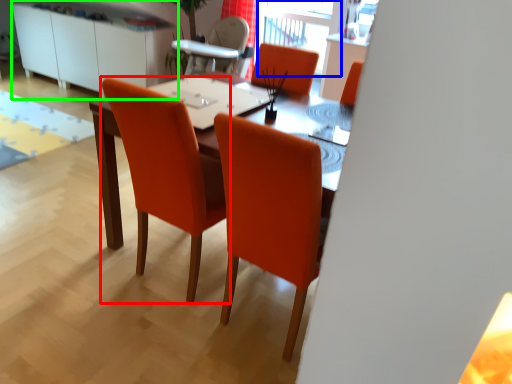
Question: Which is farther away from chair (highlighted by a red box)? window screen (highlighted by a blue box) or dresser (highlighted by a green box)?

Choices:
 (A) window screen
 (B) dresser

Answer: (B)